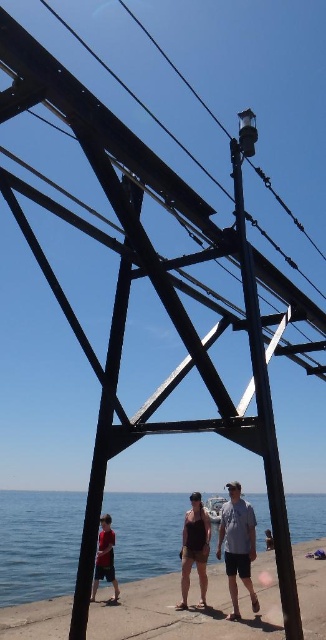
You are standing at the pier and want to take a photo of the blue water at lower center. According to the coordinates provided, where should you aim your camera?

You should aim your camera at point 0.850 on the x axis and point 0.120 on the y axis to capture the blue water at lower center.

You are standing on the pier and want to throw a ball to the person in the dark brown tank top at center from the blue water at lower center. Can you reach them with a throw?

The blue water at lower center and dark brown tank top at center are 17.57 meters apart. The average throwing distance for a person is around 15 meters, so it might be difficult to reach them with a single throw.